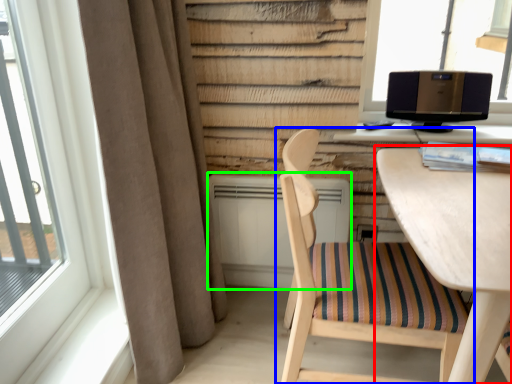
Question: Which object is the closest to the table (highlighted by a red box)? Choose among these: chair (highlighted by a blue box) or air conditioner (highlighted by a green box).

Choices:
 (A) chair
 (B) air conditioner

Answer: (A)